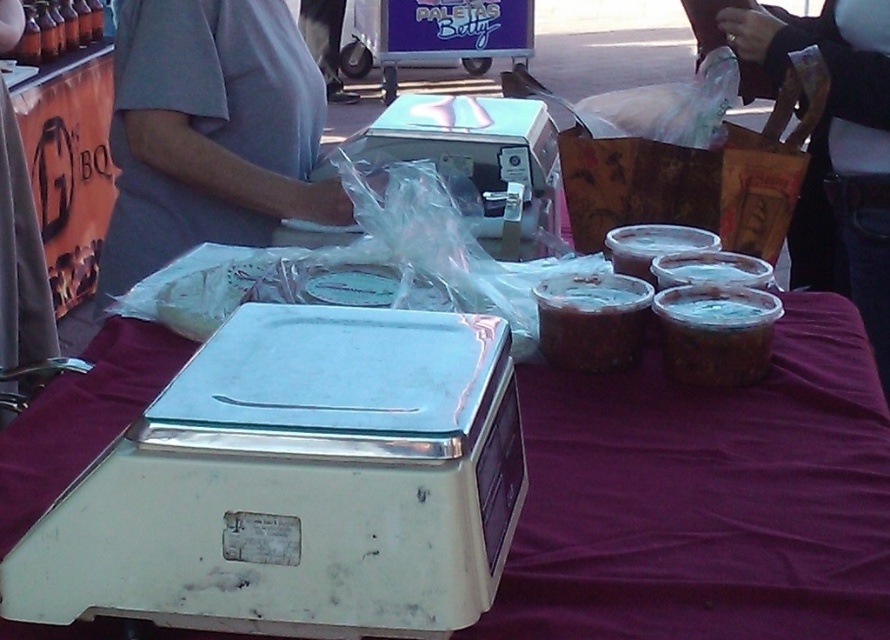
Question: Based on their relative distances, which object is nearer to the brown matte jar at center?

Choices:
 (A) brown matte plastic container at right
 (B) purple fabric at center

Answer: (A)

Question: Which of the following is the closest to the observer?

Choices:
 (A) brown matte plastic container at right
 (B) purple fabric at center
 (C) brown matte jar at center

Answer: (B)

Question: Based on their relative distances, which object is nearer to the brown matte plastic container at right?

Choices:
 (A) brown matte jar at center
 (B) purple fabric at center

Answer: (A)

Question: Can you confirm if brown matte plastic container at right is bigger than brown matte jar at center?

Choices:
 (A) yes
 (B) no

Answer: (B)

Question: Can you confirm if purple fabric at center is positioned below brown matte plastic container at right?

Choices:
 (A) yes
 (B) no

Answer: (A)

Question: Does purple fabric at center appear over brown matte jar at center?

Choices:
 (A) yes
 (B) no

Answer: (B)